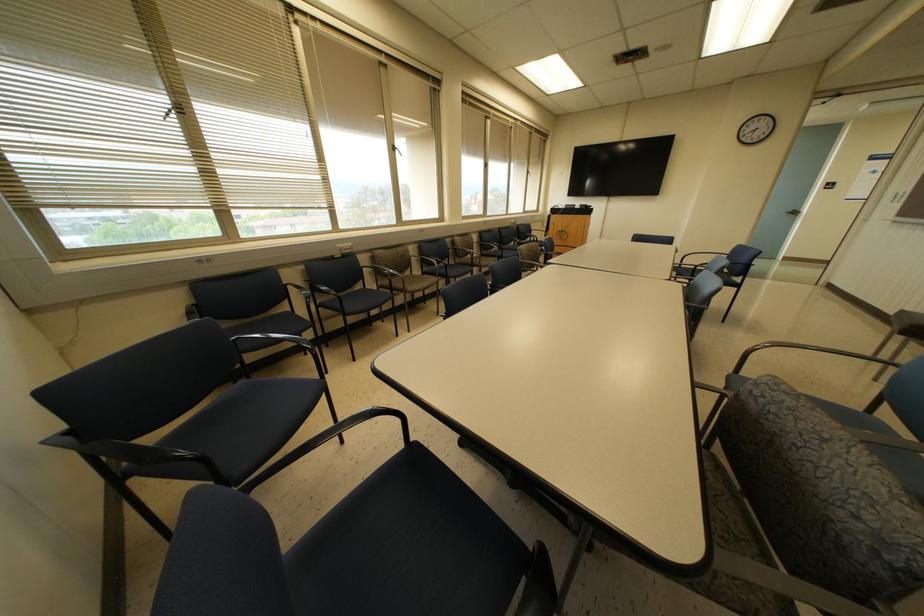
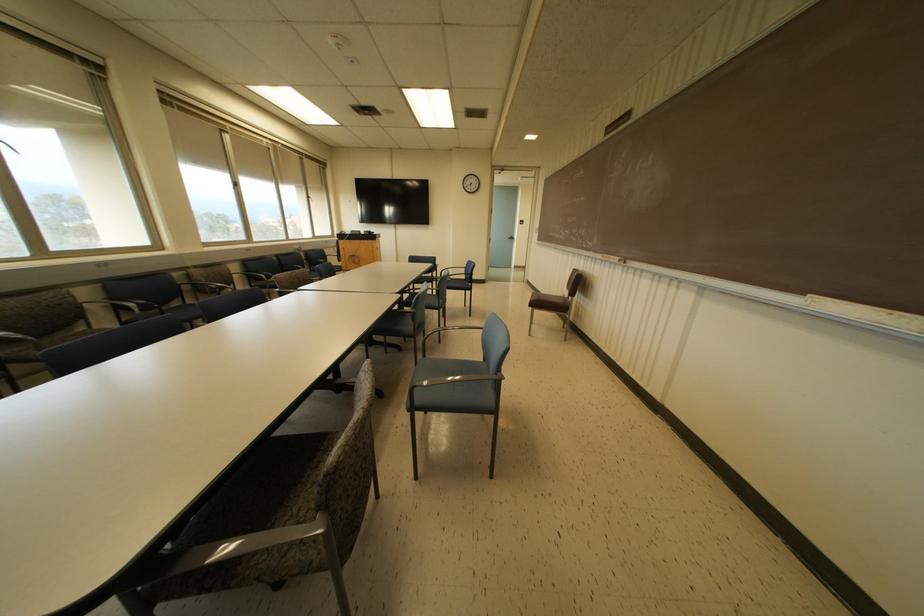
In the second image, find the point that corresponds to [736,285] in the first image.

(468, 288)